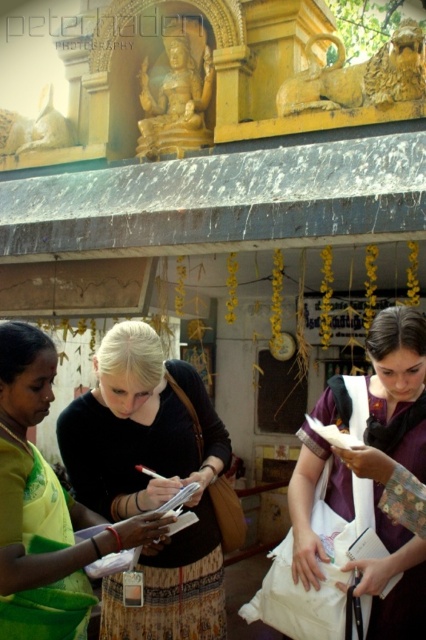
Can you confirm if black fabric skirt at center is shorter than white fabric bag at center?

Incorrect, black fabric skirt at center's height does not fall short of white fabric bag at center's.

Where is `black fabric skirt at center`? black fabric skirt at center is located at coordinates (150, 481).